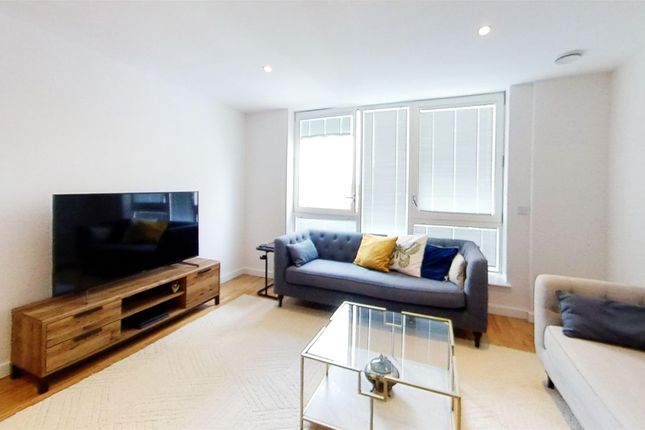
Image resolution: width=645 pixels, height=430 pixels. What are the coordinates of `windows` in the screenshot? It's located at (332, 169), (433, 160), (393, 168).